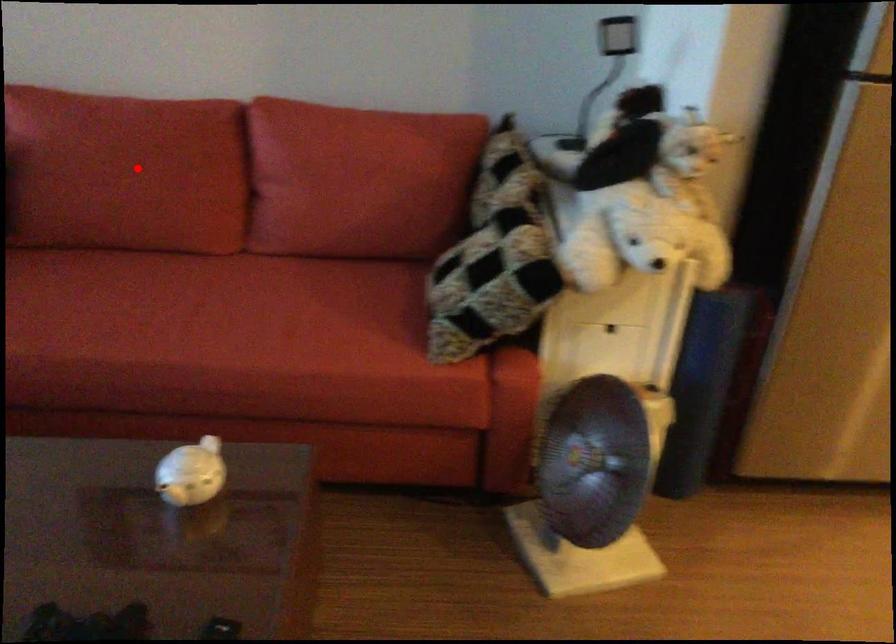
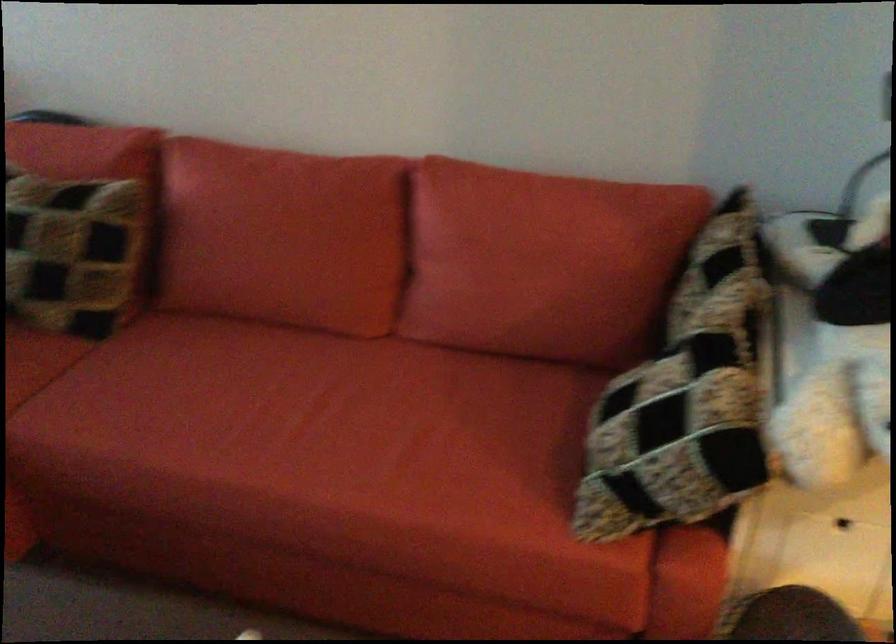
Question: A red point is marked in image1. In image2, is the corresponding 3D point closer to the camera or farther? Reply with the corresponding letter.

Choices:
 (A) The corresponding 3D point is closer.
 (B) The corresponding 3D point is farther.

Answer: (A)